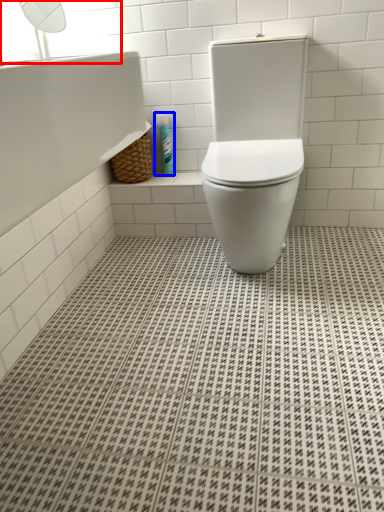
Question: Which object appears closest to the camera in this image, window screen (highlighted by a red box) or toiletry (highlighted by a blue box)?

Choices:
 (A) window screen
 (B) toiletry

Answer: (A)